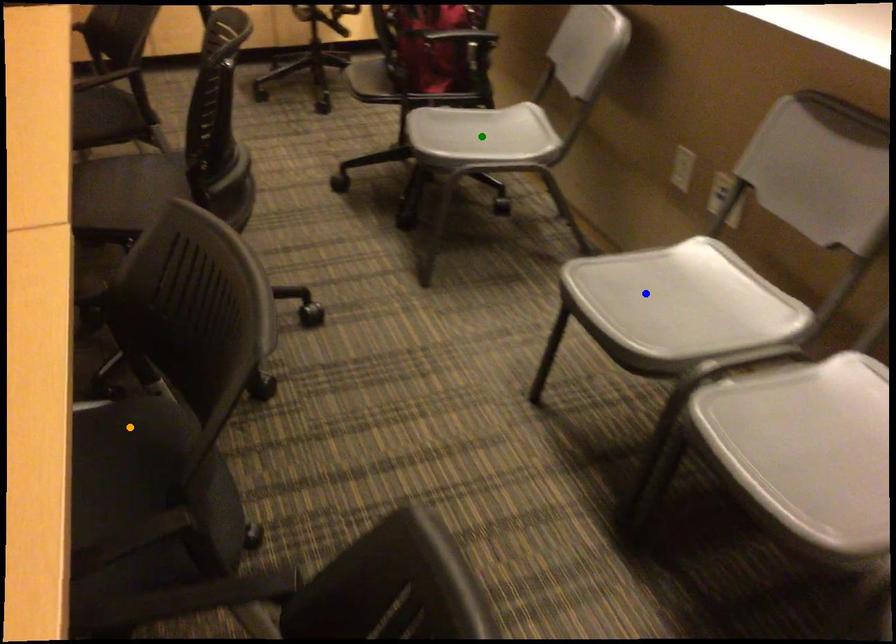
Order these from nearest to farthest:
green point, orange point, blue point

orange point, blue point, green point